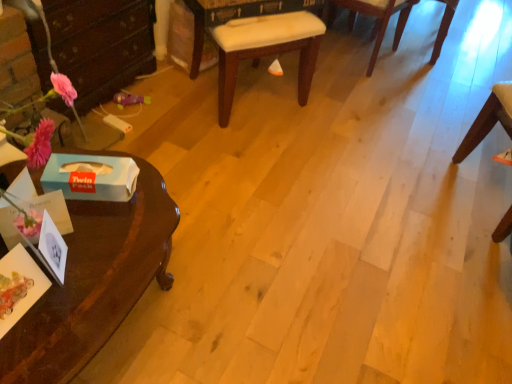
Locate an element on the screen. The width and height of the screenshot is (512, 384). free space in front of wooden chair at upper right, the third chair in the left-to-right sequence is located at coordinates (422, 73).